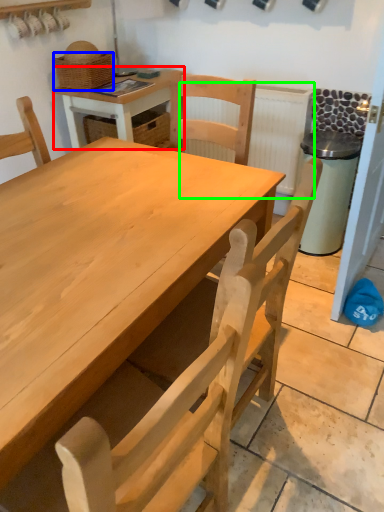
Question: Which is nearer to the table (highlighted by a red box)? basket (highlighted by a blue box) or radiator (highlighted by a green box).

Choices:
 (A) basket
 (B) radiator

Answer: (A)